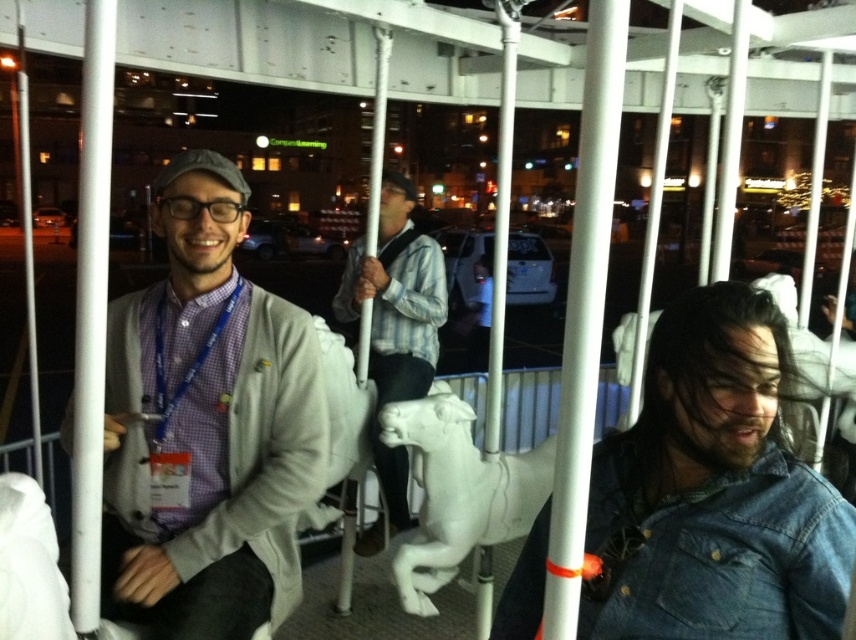
You are designing a layout for a new ride brochure and need to include both the faded denim jacket at lower right and the white matte horse at center. Since space is limited, which object should you prioritize to ensure it fits without resizing?

The white matte horse at center should be prioritized because the faded denim jacket at lower right occupies less space, making it easier to reduce its size or position it around the larger horse figure.

You are standing in front of the carousel ride at the amusement park. There are two points marked on the ride. The first point is at coordinates point [191,224] and the second point is at point [730,378]. Which point is closer to you?

Point [191,224] is further to the camera than point [730,378], so the point closer to you is point [730,378].

You are a fashion designer observing the crowd at the amusement park. You notice two attendees wearing the matte gray sweater at center and the faded denim jacket at lower right. Which clothing item is bigger in size?

The matte gray sweater at center has a larger size compared to the faded denim jacket at lower right.